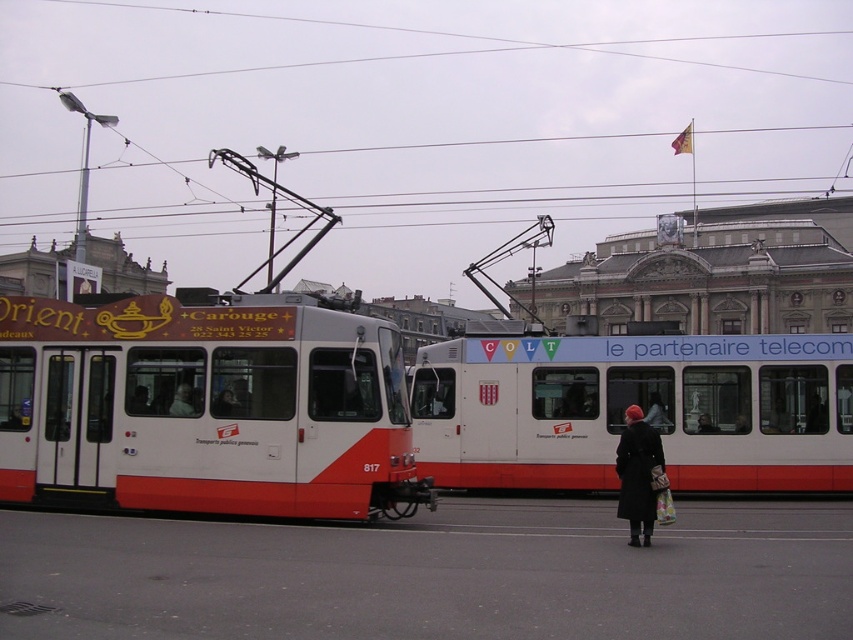
Question: Does white glossy passenger train at center appear over dark brown leather coat at center?

Choices:
 (A) no
 (B) yes

Answer: (B)

Question: Is smooth plastic face at center further to the viewer compared to dark brown leather coat at center?

Choices:
 (A) yes
 (B) no

Answer: (B)

Question: Estimate the real-world distances between objects in this image. Which object is farther from the black wool coat at lower right?

Choices:
 (A) white glossy passenger train at center
 (B) dark brown leather coat at center
 (C) white glossy tram at center
 (D) smooth plastic face at center

Answer: (B)

Question: Which object appears closest to the camera in this image?

Choices:
 (A) white glossy passenger train at center
 (B) dark brown leather coat at center
 (C) white glossy tram at center
 (D) smooth plastic face at center

Answer: (C)

Question: Which is farther from the smooth plastic face at center?

Choices:
 (A) white glossy tram at center
 (B) white glossy passenger train at center
 (C) dark brown leather coat at center
 (D) black wool coat at lower right

Answer: (C)

Question: Is white glossy passenger train at center to the right of black wool coat at lower right from the viewer's perspective?

Choices:
 (A) yes
 (B) no

Answer: (A)